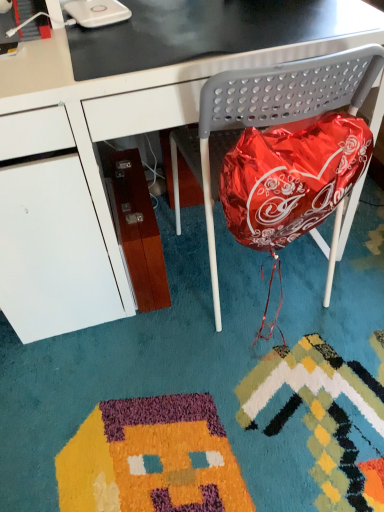
Where is `free space in front of black glossy desk at center`? This screenshot has height=512, width=384. free space in front of black glossy desk at center is located at coordinates (169, 401).